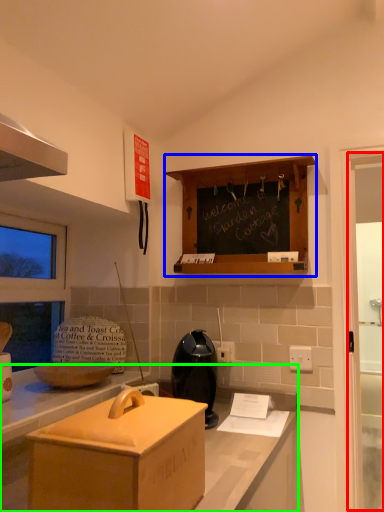
Question: Which is farther away from glass door (highlighted by a red box)? cabinetry (highlighted by a blue box) or countertop (highlighted by a green box)?

Choices:
 (A) cabinetry
 (B) countertop

Answer: (B)